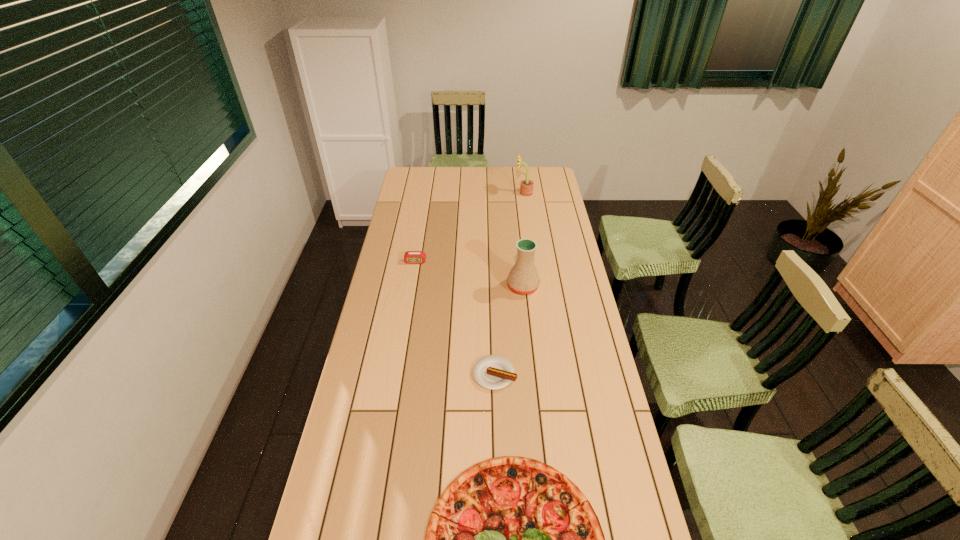
Locate an element on the screen. The width and height of the screenshot is (960, 540). blank space located on the front-facing side of the alarm clock is located at coordinates (409, 299).

Image resolution: width=960 pixels, height=540 pixels. What are the coordinates of `free space located 0.310m on the back of the fourth tallest object` in the screenshot? It's located at (492, 294).

At what (x,y) coordinates should I click in order to perform the action: click on object present at the far edge. Please return your answer as a coordinate pair (x, y). Looking at the image, I should click on (526, 188).

Locate an element on the screen. object that is positioned at the left edge is located at coordinates coord(411,257).

Where is `object present at the right edge`? The width and height of the screenshot is (960, 540). object present at the right edge is located at coordinates (526, 188).

Where is `object at the far right corner`? This screenshot has width=960, height=540. object at the far right corner is located at coordinates (526, 188).

Identify the location of blank space at the far edge of the desktop. The image size is (960, 540). (489, 183).

Find the location of a particular element. This screenshot has height=540, width=960. vacant region at the left edge of the desktop is located at coordinates (392, 271).

You are a GUI agent. You are given a task and a screenshot of the screen. Output one action in this format:
    pyautogui.click(x=<x>, y=<y>)
    Task: Click on the free region at the right edge of the desktop
    This screenshot has width=960, height=540.
    Given the screenshot: What is the action you would take?
    pyautogui.click(x=559, y=346)

Identify the location of vacant space at the far right corner of the desktop. This screenshot has width=960, height=540. (544, 169).